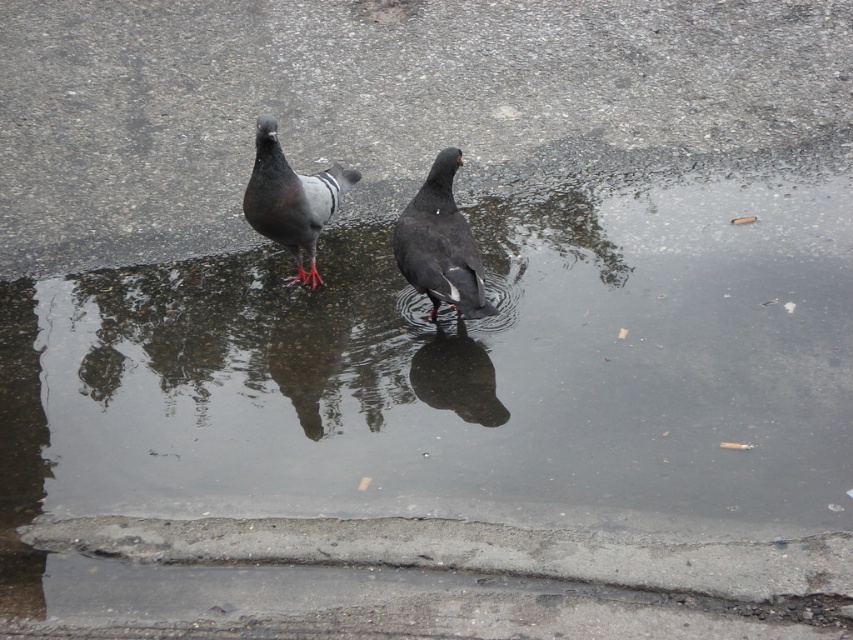
You are standing 5 meters away from a gray matte pigeon at center on a wet paved surface. Can you reach the pigeon by taking one step forward?

The gray matte pigeon at center is 4.59 meters away from you. Since you are currently 5 meters away, taking one step forward would reduce the distance, potentially allowing you to reach it if your step covers at least 0.41 meters.

From the picture: You are standing at the origin point of the coordinate system. You see a point labeled as point (x=440, y=244). What object is located at that point?

The point (x=440, y=244) is where the matte black pigeon at center is located.